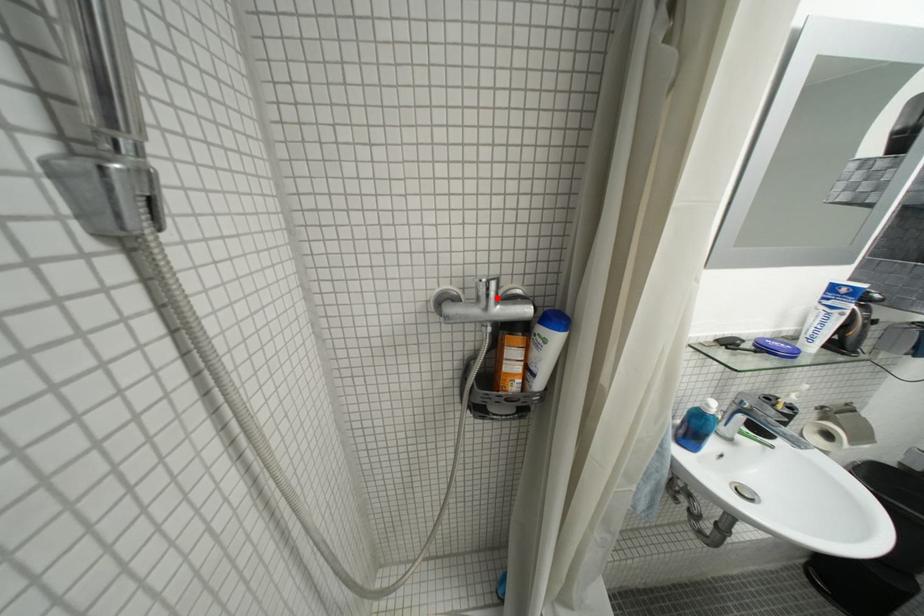
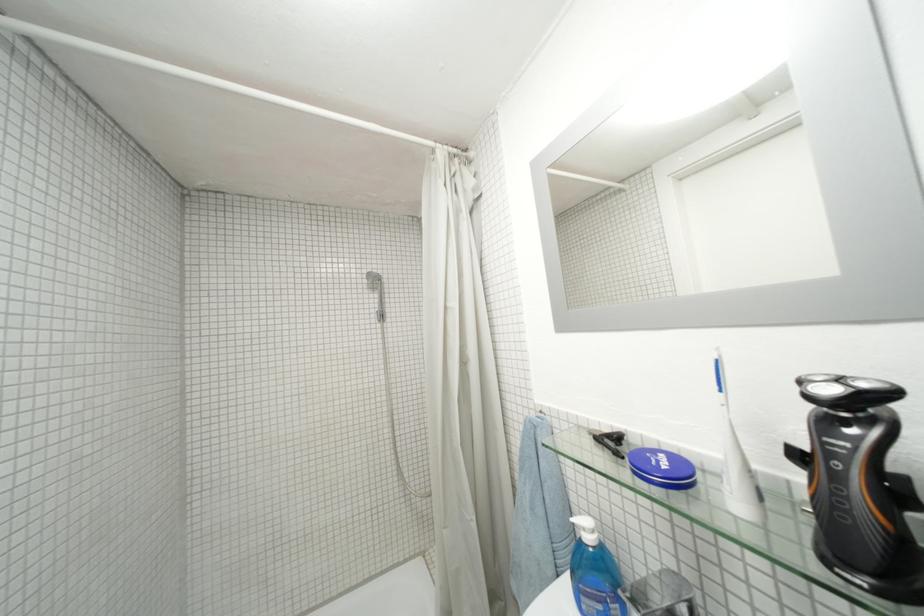
Question: I am providing you with two images of the same scene from different viewpoints. A red point is marked on the first image. Is the red point's position out of view in image 2?

Choices:
 (A) Yes
 (B) No

Answer: (A)